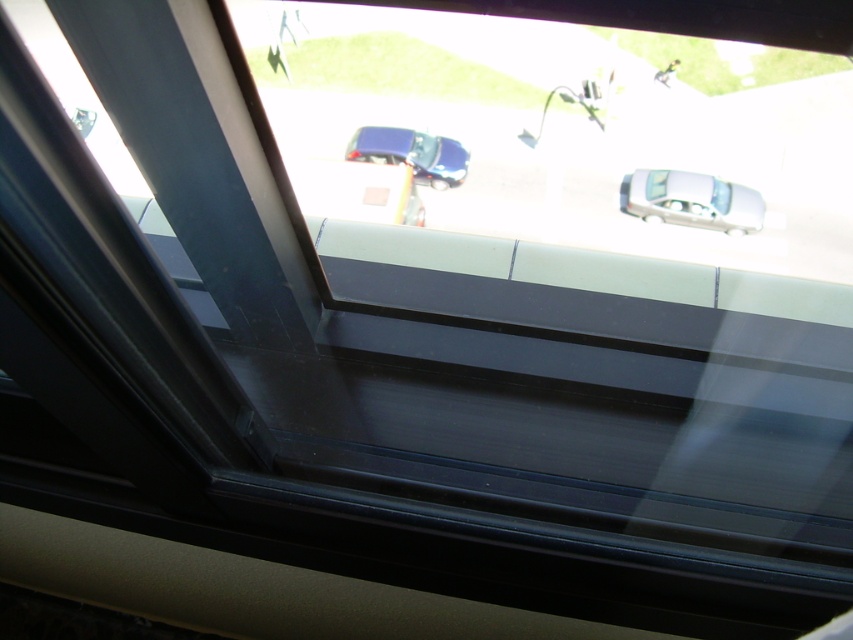
Is white glossy car at center positioned before shiny blue car at center?

Yes, white glossy car at center is in front of shiny blue car at center.

Is white glossy car at center taller than shiny blue car at center?

No.

Locate an element on the screen. white glossy car at center is located at coordinates (692, 200).